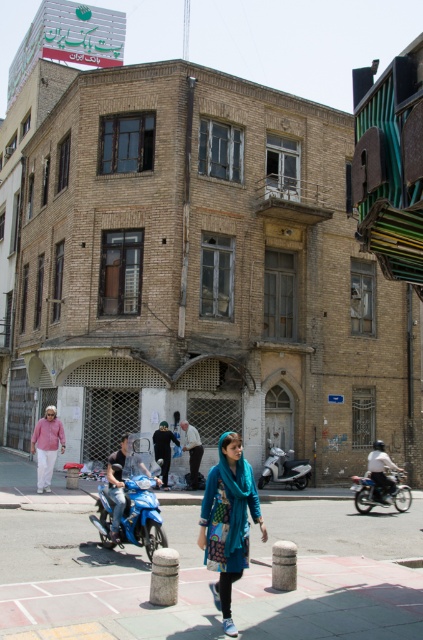
Which is more to the left, teal fabric scarf at center or blue fabric jacket at center?

blue fabric jacket at center

Between teal fabric scarf at center and blue fabric jacket at center, which one appears on the right side from the viewer's perspective?

teal fabric scarf at center

Does point (230, 488) come in front of point (120, 492)?

That is True.

This screenshot has height=640, width=423. I want to click on teal fabric scarf at center, so click(227, 520).

Does matte pink sweater at lower left have a lesser width compared to dark blue leather jacket at center?

No, matte pink sweater at lower left is not thinner than dark blue leather jacket at center.

This screenshot has width=423, height=640. What do you see at coordinates (46, 445) in the screenshot?
I see `matte pink sweater at lower left` at bounding box center [46, 445].

This screenshot has width=423, height=640. Identify the location of matte pink sweater at lower left. (46, 445).

Where is `matte pink sweater at lower left`? matte pink sweater at lower left is located at coordinates (46, 445).

Does point (104, 538) lie behind point (49, 467)?

That is False.

Which is more to the right, shiny blue motorcycle at center or matte pink sweater at lower left?

Positioned to the right is shiny blue motorcycle at center.

This screenshot has height=640, width=423. What do you see at coordinates (131, 515) in the screenshot?
I see `shiny blue motorcycle at center` at bounding box center [131, 515].

What are the coordinates of `shiny blue motorcycle at center` in the screenshot? It's located at (x=131, y=515).